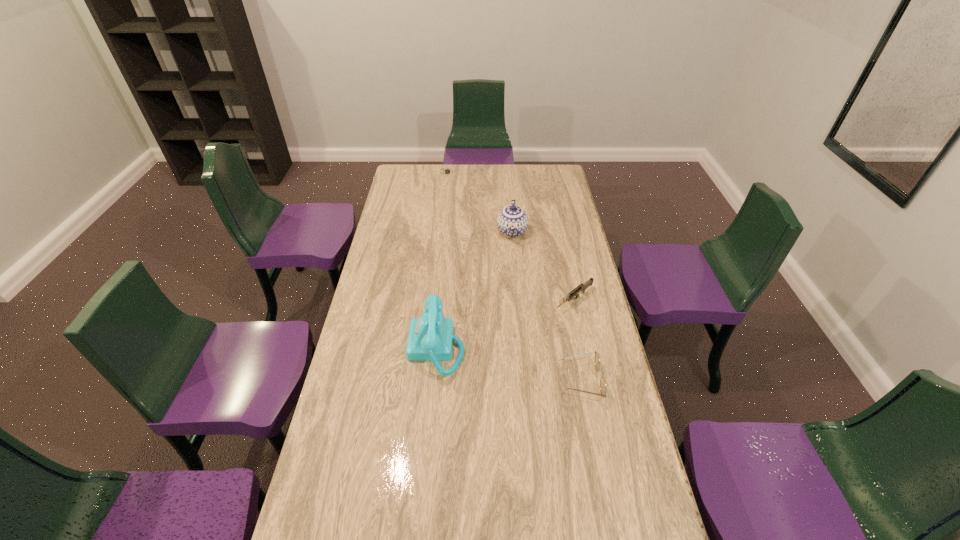
What are the coordinates of `free space located 0.180m on the front-facing side of the spectacles` in the screenshot? It's located at (506, 380).

At what (x,y) coordinates should I click in order to perform the action: click on vacant space located on the front-facing side of the spectacles. Please return your answer as a coordinate pair (x, y). Looking at the image, I should click on (521, 380).

Locate an element on the screen. vacant space situated on the front-facing side of the spectacles is located at coordinates (538, 380).

Identify the location of vacant region located aimed along the barrel of the gun. This screenshot has width=960, height=540. (543, 323).

I want to click on vacant space situated aimed along the barrel of the gun, so click(x=527, y=337).

This screenshot has height=540, width=960. I want to click on vacant space situated aimed along the barrel of the gun, so click(533, 333).

You are a GUI agent. You are given a task and a screenshot of the screen. Output one action in this format:
    pyautogui.click(x=<x>, y=<y>)
    Task: Click on the vacant space situated on the face of the farthest object
    
    Given the screenshot: What is the action you would take?
    pyautogui.click(x=452, y=188)

Identify the location of vacant space located on the face of the farthest object. The height and width of the screenshot is (540, 960). (454, 195).

Locate an element on the screen. vacant area located 0.060m on the face of the farthest object is located at coordinates (450, 183).

At what (x,y) coordinates should I click in order to perform the action: click on free region located at the spout of the third object from left to right. Please return your answer as a coordinate pair (x, y). Image resolution: width=960 pixels, height=540 pixels. Looking at the image, I should click on (511, 290).